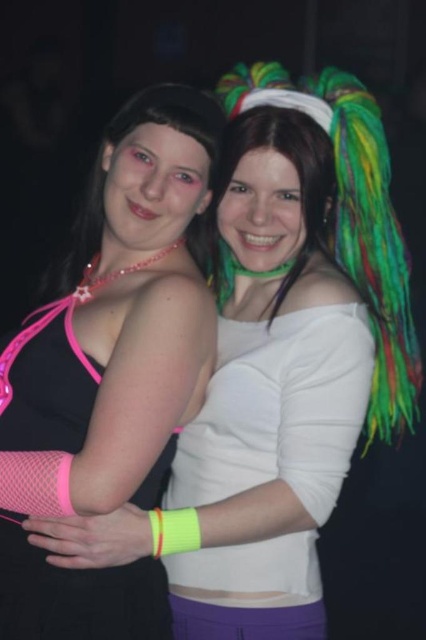
Based on the photo, is matte black tank top at center closer to camera compared to neon yellow fabric at center?

That is True.

Can you confirm if matte black tank top at center is positioned to the left of neon yellow fabric at center?

Yes, matte black tank top at center is to the left of neon yellow fabric at center.

Which is in front, point (161, 356) or point (301, 588)?

Positioned in front is point (161, 356).

The width and height of the screenshot is (426, 640). I want to click on matte black tank top at center, so 111,372.

Who is higher up, matte white shirt at center or matte black hair at left?

Positioned higher is matte black hair at left.

Is point (233, 164) more distant than point (161, 108)?

Yes, point (233, 164) is behind point (161, 108).

This screenshot has width=426, height=640. Describe the element at coordinates (299, 182) in the screenshot. I see `matte white shirt at center` at that location.

At what (x,y) coordinates should I click in order to perform the action: click on matte white shirt at center. Please return your answer as a coordinate pair (x, y). Looking at the image, I should click on (299, 182).

Looking at this image, who is more forward, (x=17, y=419) or (x=247, y=116)?

Positioned in front is point (x=17, y=419).

Is pink mesh dress at center positioned behind matte white shirt at center?

No, it is in front of matte white shirt at center.

The width and height of the screenshot is (426, 640). Find the location of `pink mesh dress at center`. pink mesh dress at center is located at coordinates coord(77,595).